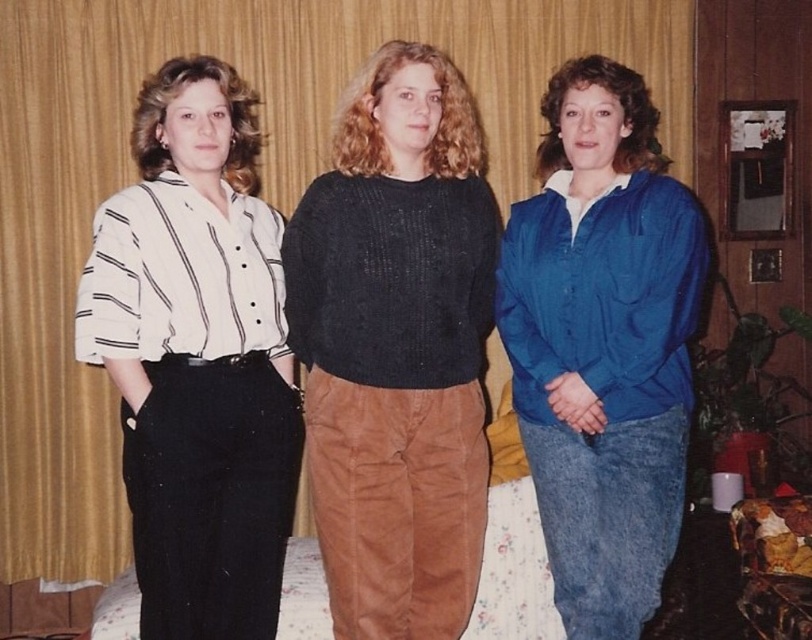
You are organizing a charity event and need to decide which item to donate first. The blue denim jacket at center and the floral fabric bed at center are both available. Based on their sizes, which one should you choose to donate first if you want to prioritize the larger item?

The blue denim jacket at center is bigger than the floral fabric bed at center, so you should donate the blue denim jacket at center first since it is the larger item.

You are trying to decide whether to place the black knitted sweater at center on the floral fabric bed at center. Based on their sizes, will the sweater fit entirely on the bed without hanging over the edges?

The black knitted sweater at center is wider than the floral fabric bed at center, so placing it entirely on the bed without any part hanging over the edges would not be possible.

You are organizing a clothing rack and need to place the white striped shirt at left and the blue denim jacket at center. Given their widths, which one should you place on the narrower hanger?

The white striped shirt at left has a lesser width compared to the blue denim jacket at center, so it should be placed on the narrower hanger.